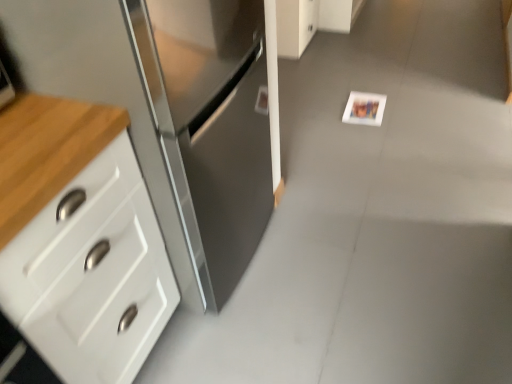
What do you see at coordinates (364, 109) in the screenshot? I see `white matte postcard at center` at bounding box center [364, 109].

This screenshot has height=384, width=512. What do you see at coordinates (295, 26) in the screenshot? I see `white glossy cabinet at upper center, which appears as the second cabinetry when viewed from the left` at bounding box center [295, 26].

At what (x,y) coordinates should I click in order to perform the action: click on white matte postcard at center. Please return your answer as a coordinate pair (x, y). Image resolution: width=512 pixels, height=384 pixels. Looking at the image, I should click on (364, 109).

Identify the location of cabinetry located on the left of white glossy cabinet at upper center, marked as the 1th cabinetry in a top-to-bottom arrangement. (167, 121).

From a real-world perspective, is white glossy cabinet at upper center, the second cabinetry when ordered from bottom to top, positioned above or below stainless steel cabinet at left, the second cabinetry viewed from the back?

Clearly, from a real-world perspective, white glossy cabinet at upper center, the second cabinetry when ordered from bottom to top, is below stainless steel cabinet at left, the second cabinetry viewed from the back.

Based on their positions, is white glossy cabinet at upper center, arranged as the second cabinetry when viewed from the front, located to the left or right of stainless steel cabinet at left, the first cabinetry positioned from the bottom?

In the image, white glossy cabinet at upper center, arranged as the second cabinetry when viewed from the front, appears on the right side of stainless steel cabinet at left, the first cabinetry positioned from the bottom.

Is white glossy cabinet at upper center, the first cabinetry positioned from the back, facing away from stainless steel cabinet at left, the first cabinetry positioned from the bottom?

No, stainless steel cabinet at left, the first cabinetry positioned from the bottom, is not at the back of white glossy cabinet at upper center, the first cabinetry positioned from the back.

Visually, is stainless steel cabinet at left, the first cabinetry positioned from the bottom, positioned to the left or to the right of white glossy cabinet at upper center, the first cabinetry positioned from the back?

In the image, stainless steel cabinet at left, the first cabinetry positioned from the bottom, appears on the left side of white glossy cabinet at upper center, the first cabinetry positioned from the back.

From a real-world perspective, who is located lower, stainless steel cabinet at left, the second cabinetry viewed from the back, or white glossy cabinet at upper center, placed as the 1th cabinetry when sorted from right to left?

white glossy cabinet at upper center, placed as the 1th cabinetry when sorted from right to left.

Looking at their sizes, would you say stainless steel cabinet at left, the first cabinetry positioned from the left, is wider or thinner than white glossy cabinet at upper center, marked as the 1th cabinetry in a top-to-bottom arrangement?

stainless steel cabinet at left, the first cabinetry positioned from the left, is wider than white glossy cabinet at upper center, marked as the 1th cabinetry in a top-to-bottom arrangement.

Which is correct: stainless steel cabinet at left, positioned as the second cabinetry in right-to-left order, is inside white glossy cabinet at upper center, the first cabinetry positioned from the back, or outside of it?

stainless steel cabinet at left, positioned as the second cabinetry in right-to-left order, lies outside white glossy cabinet at upper center, the first cabinetry positioned from the back.

Is stainless steel cabinet at left, the first cabinetry positioned from the left, facing towards white matte postcard at center?

No, stainless steel cabinet at left, the first cabinetry positioned from the left, is not turned towards white matte postcard at center.

Measure the distance between stainless steel cabinet at left, which appears as the 2th cabinetry when viewed from the top, and white matte postcard at center.

→ A distance of 1.30 meters exists between stainless steel cabinet at left, which appears as the 2th cabinetry when viewed from the top, and white matte postcard at center.

Is point (137, 154) positioned in front of point (367, 102)?

Yes.

Looking at the image, does stainless steel cabinet at left, the first cabinetry positioned from the bottom, seem bigger or smaller compared to white matte postcard at center?

Clearly, stainless steel cabinet at left, the first cabinetry positioned from the bottom, is larger in size than white matte postcard at center.

From a real-world perspective, is white glossy cabinet at upper center, which appears as the second cabinetry when viewed from the left, on top of white matte postcard at center?

Yes, from a real-world perspective, white glossy cabinet at upper center, which appears as the second cabinetry when viewed from the left, is over white matte postcard at center

Is white matte postcard at center at the back of white glossy cabinet at upper center, the first cabinetry positioned from the back?

That's not correct — white glossy cabinet at upper center, the first cabinetry positioned from the back, is not looking away from white matte postcard at center.

Is white glossy cabinet at upper center, arranged as the second cabinetry when viewed from the front, with white matte postcard at center?

white glossy cabinet at upper center, arranged as the second cabinetry when viewed from the front, and white matte postcard at center are clearly separated.

Where is `the 1st cabinetry located above the white matte postcard at center (from a real-world perspective)`? Image resolution: width=512 pixels, height=384 pixels. the 1st cabinetry located above the white matte postcard at center (from a real-world perspective) is located at coordinates (295, 26).

Considering the relative sizes of white matte postcard at center and stainless steel cabinet at left, the first cabinetry from the front, in the image provided, is white matte postcard at center shorter than stainless steel cabinet at left, the first cabinetry from the front,?

Correct, white matte postcard at center is not as tall as stainless steel cabinet at left, the first cabinetry from the front.

What's the angular difference between white matte postcard at center and stainless steel cabinet at left, the first cabinetry positioned from the bottom,'s facing directions?

white matte postcard at center and stainless steel cabinet at left, the first cabinetry positioned from the bottom, are facing 92.4 degrees away from each other.

Considering the relative sizes of white matte postcard at center and stainless steel cabinet at left, positioned as the second cabinetry in right-to-left order, in the image provided, is white matte postcard at center smaller than stainless steel cabinet at left, positioned as the second cabinetry in right-to-left order,?

Indeed, white matte postcard at center has a smaller size compared to stainless steel cabinet at left, positioned as the second cabinetry in right-to-left order.

Based on the photo, is white matte postcard at center far away from stainless steel cabinet at left, the first cabinetry positioned from the bottom?

Yes, white matte postcard at center is far from stainless steel cabinet at left, the first cabinetry positioned from the bottom.

Considering the sizes of objects white matte postcard at center and white glossy cabinet at upper center, marked as the 1th cabinetry in a top-to-bottom arrangement, in the image provided, who is thinner, white matte postcard at center or white glossy cabinet at upper center, marked as the 1th cabinetry in a top-to-bottom arrangement,?

Thinner between the two is white matte postcard at center.

Which of these two, white matte postcard at center or white glossy cabinet at upper center, the second cabinetry when ordered from bottom to top, stands taller?

Standing taller between the two is white glossy cabinet at upper center, the second cabinetry when ordered from bottom to top.

Is white glossy cabinet at upper center, placed as the 1th cabinetry when sorted from right to left, at the back of white matte postcard at center?

That's not correct — white matte postcard at center is not looking away from white glossy cabinet at upper center, placed as the 1th cabinetry when sorted from right to left.

Considering the positions of objects white matte postcard at center and white glossy cabinet at upper center, arranged as the second cabinetry when viewed from the front, in the image provided, who is behind, white matte postcard at center or white glossy cabinet at upper center, arranged as the second cabinetry when viewed from the front,?

white glossy cabinet at upper center, arranged as the second cabinetry when viewed from the front, is behind.

Identify the location of cabinetry directly beneath the stainless steel cabinet at left, the first cabinetry positioned from the bottom (from a real-world perspective). (295, 26).

There is a white glossy cabinet at upper center, the first cabinetry positioned from the back. At what (x,y) coordinates should I click in order to perform the action: click on cabinetry above it (from a real-world perspective). Please return your answer as a coordinate pair (x, y). Image resolution: width=512 pixels, height=384 pixels. Looking at the image, I should click on point(167,121).

From the picture: Looking at the image, which one is located closer to stainless steel cabinet at left, the first cabinetry positioned from the left, white matte postcard at center or white glossy cabinet at upper center, placed as the 1th cabinetry when sorted from right to left?

white matte postcard at center is closer to stainless steel cabinet at left, the first cabinetry positioned from the left.

Estimate the real-world distances between objects in this image. Which object is closer to white matte postcard at center, white glossy cabinet at upper center, the second cabinetry when ordered from bottom to top, or stainless steel cabinet at left, which appears as the 2th cabinetry when viewed from the top?

white glossy cabinet at upper center, the second cabinetry when ordered from bottom to top, is positioned closer to the anchor white matte postcard at center.

From the picture: Estimate the real-world distances between objects in this image. Which object is further from stainless steel cabinet at left, the first cabinetry positioned from the left, white glossy cabinet at upper center, which appears as the second cabinetry when viewed from the left, or white matte postcard at center?

white glossy cabinet at upper center, which appears as the second cabinetry when viewed from the left.

From the image, which object appears to be nearer to white glossy cabinet at upper center, placed as the 1th cabinetry when sorted from right to left, white matte postcard at center or stainless steel cabinet at left, the first cabinetry positioned from the bottom?

white matte postcard at center lies closer to white glossy cabinet at upper center, placed as the 1th cabinetry when sorted from right to left, than the other object.

From the image, which object appears to be nearer to white matte postcard at center, stainless steel cabinet at left, the first cabinetry from the front, or white glossy cabinet at upper center, placed as the 1th cabinetry when sorted from right to left?

The object closer to white matte postcard at center is white glossy cabinet at upper center, placed as the 1th cabinetry when sorted from right to left.

Which object lies further to the anchor point white glossy cabinet at upper center, arranged as the second cabinetry when viewed from the front, stainless steel cabinet at left, the first cabinetry positioned from the bottom, or white matte postcard at center?

stainless steel cabinet at left, the first cabinetry positioned from the bottom, is positioned further to the anchor white glossy cabinet at upper center, arranged as the second cabinetry when viewed from the front.

Where is `postcard positioned between stainless steel cabinet at left, the first cabinetry positioned from the bottom, and white glossy cabinet at upper center, marked as the 1th cabinetry in a top-to-bottom arrangement, from near to far`? postcard positioned between stainless steel cabinet at left, the first cabinetry positioned from the bottom, and white glossy cabinet at upper center, marked as the 1th cabinetry in a top-to-bottom arrangement, from near to far is located at coordinates (364, 109).